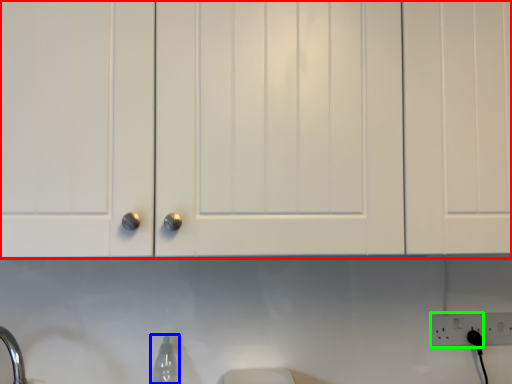
Question: Which object is positioned closest to cabinetry (highlighted by a red box)? Select from bottle (highlighted by a blue box) and electric outlet (highlighted by a green box).

Choices:
 (A) bottle
 (B) electric outlet

Answer: (A)